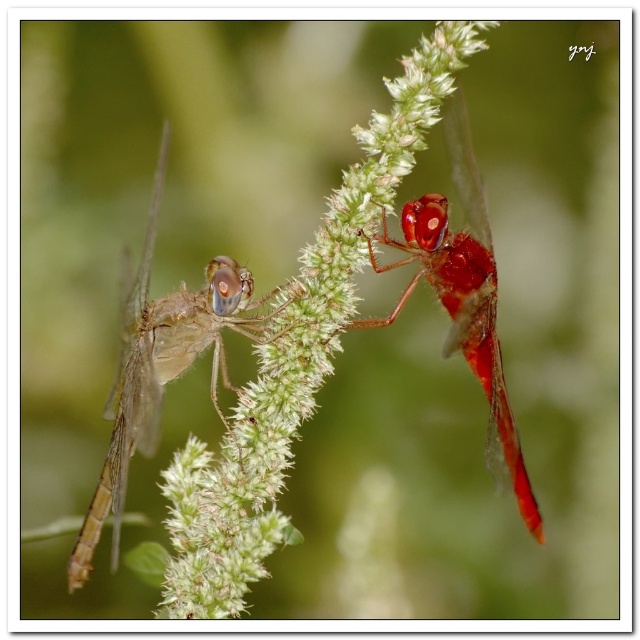
From the picture: Who is shorter, translucent brown dragonfly at left or shiny red dragonfly at upper right?

Standing shorter between the two is shiny red dragonfly at upper right.

From the picture: Is translucent brown dragonfly at left to the right of shiny red dragonfly at upper right from the viewer's perspective?

No, translucent brown dragonfly at left is not to the right of shiny red dragonfly at upper right.

Is point (140, 397) positioned before point (458, 170)?

Yes, point (140, 397) is closer to viewer.

Find the location of a particular element. The height and width of the screenshot is (640, 640). translucent brown dragonfly at left is located at coordinates (164, 365).

Does green fuzzy plant at center appear on the left side of shiny red dragonfly at upper right?

Correct, you'll find green fuzzy plant at center to the left of shiny red dragonfly at upper right.

The image size is (640, 640). What do you see at coordinates (296, 355) in the screenshot?
I see `green fuzzy plant at center` at bounding box center [296, 355].

Where is `green fuzzy plant at center`? green fuzzy plant at center is located at coordinates (296, 355).

I want to click on green fuzzy plant at center, so click(296, 355).

Between green fuzzy plant at center and translucent brown dragonfly at left, which one appears on the right side from the viewer's perspective?

From the viewer's perspective, green fuzzy plant at center appears more on the right side.

Between green fuzzy plant at center and translucent brown dragonfly at left, which one appears on the left side from the viewer's perspective?

translucent brown dragonfly at left

Which is behind, point (369, 134) or point (184, 323)?

The point (184, 323) is behind.

What are the coordinates of `green fuzzy plant at center` in the screenshot? It's located at (296, 355).